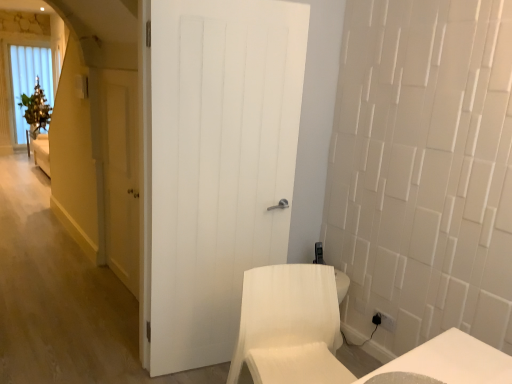
Question: Do you think yellow matte door at left, the 2th door in the right-to-left sequence, is within white fabric chair at lower right, or outside of it?

Choices:
 (A) outside
 (B) inside

Answer: (A)

Question: Considering the positions of yellow matte door at left, positioned as the 1th door in back-to-front order, and white fabric chair at lower right in the image, is yellow matte door at left, positioned as the 1th door in back-to-front order, wider or thinner than white fabric chair at lower right?

Choices:
 (A) wide
 (B) thin

Answer: (B)

Question: Estimate the real-world distances between objects in this image. Which object is farther from the white fabric chair at lower right?

Choices:
 (A) yellow matte door at left, arranged as the 1th door when viewed from the left
 (B) white wooden door at center, marked as the first door in a front-to-back arrangement

Answer: (A)

Question: Which is nearer to the white wooden door at center, the second door when ordered from back to front?

Choices:
 (A) white fabric chair at lower right
 (B) yellow matte door at left, the 2th door in the front-to-back sequence

Answer: (A)